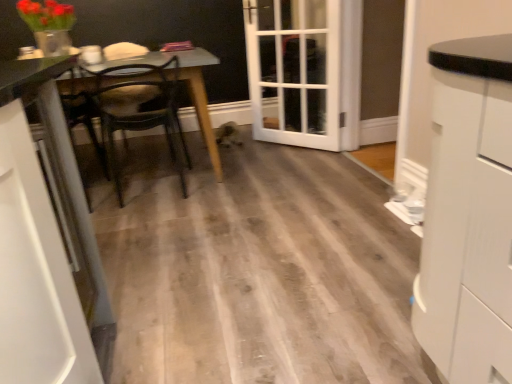
The image size is (512, 384). Find the location of `vacant area to the left of white glass door at center`. vacant area to the left of white glass door at center is located at coordinates (250, 145).